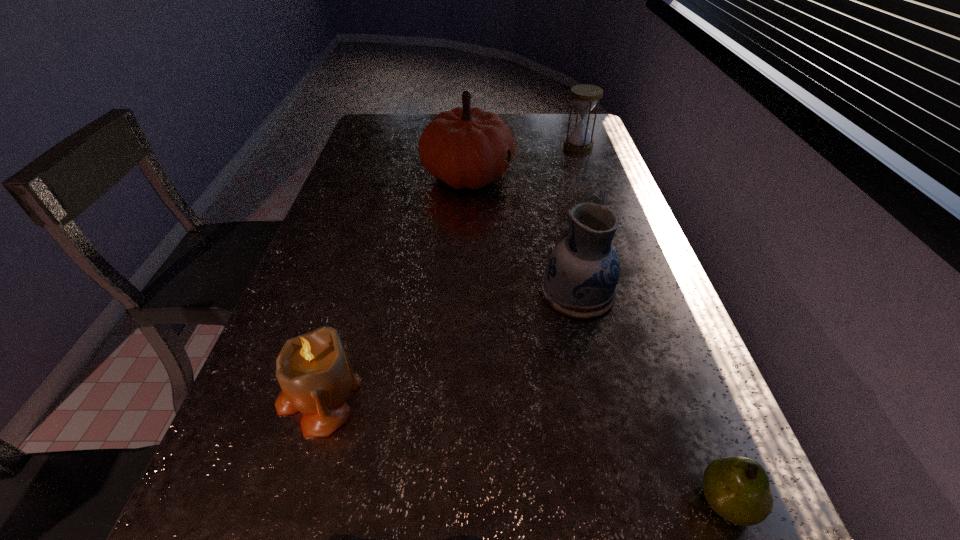
The width and height of the screenshot is (960, 540). What are the coordinates of `pumpkin` in the screenshot? It's located at (465, 147).

Image resolution: width=960 pixels, height=540 pixels. Find the location of `pottery`. pottery is located at coordinates pos(582,272).

Locate an element on the screen. hourglass is located at coordinates (585, 96).

You are a GUI agent. You are given a task and a screenshot of the screen. Output one action in this format:
    pyautogui.click(x=<x>, y=<y>)
    Task: Click on the fourth farthest object
    
    Given the screenshot: What is the action you would take?
    313,370

Identify the location of the fourth tallest object. [x=313, y=370].

The height and width of the screenshot is (540, 960). Identify the location of the fifth farthest object. (737, 488).

Find the location of a particular element. the fifth tallest object is located at coordinates (737, 488).

This screenshot has width=960, height=540. Find the location of `free spot located on the front-facing side of the pumpkin`. free spot located on the front-facing side of the pumpkin is located at coordinates (607, 173).

This screenshot has height=540, width=960. In order to click on free space located on the back of the pottery in this screenshot , I will do `click(565, 241)`.

This screenshot has width=960, height=540. Identify the location of vacant area situated 0.330m on the left of the hourglass. (468, 146).